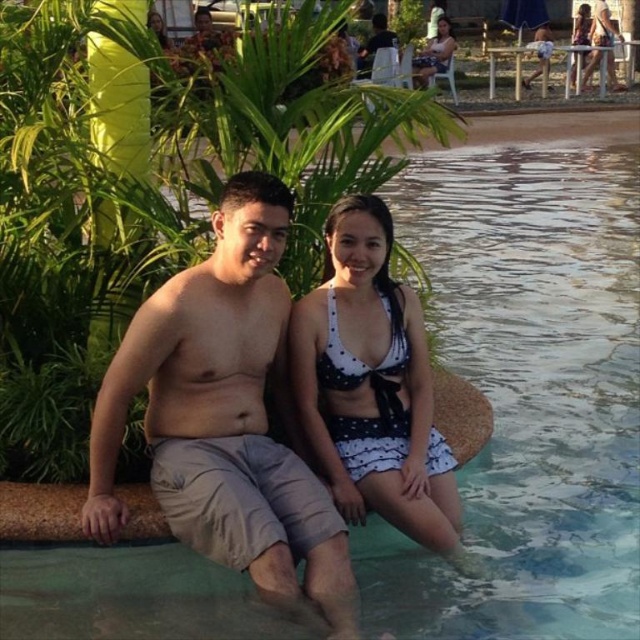
Does white dotted fabric bikini at center appear on the left side of white dotted fabric bikini top at center?

In fact, white dotted fabric bikini at center is to the right of white dotted fabric bikini top at center.

This screenshot has width=640, height=640. What do you see at coordinates (372, 385) in the screenshot? I see `white dotted fabric bikini at center` at bounding box center [372, 385].

Locate an element on the screen. This screenshot has width=640, height=640. white dotted fabric bikini at center is located at coordinates (372, 385).

Does white dotted fabric bikini top at center have a greater width compared to black matte shorts at lower center?

Incorrect, white dotted fabric bikini top at center's width does not surpass black matte shorts at lower center's.

Image resolution: width=640 pixels, height=640 pixels. What do you see at coordinates (362, 360) in the screenshot?
I see `white dotted fabric bikini top at center` at bounding box center [362, 360].

Where is `white dotted fabric bikini top at center`? This screenshot has width=640, height=640. white dotted fabric bikini top at center is located at coordinates (362, 360).

Between point (216, 339) and point (406, 362), which one is positioned in front?

Point (216, 339) is in front.

Is tan cotton shorts at center positioned in front of white dotted fabric bikini top at center?

Yes, tan cotton shorts at center is closer to the viewer.

What are the coordinates of `tan cotton shorts at center` in the screenshot? It's located at (225, 413).